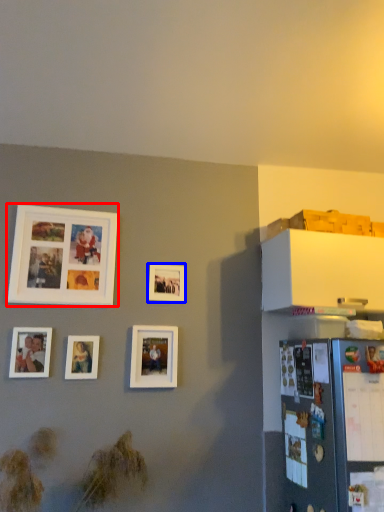
Question: Which of the following is the farthest to the observer, picture frame (highlighted by a red box) or picture frame (highlighted by a blue box)?

Choices:
 (A) picture frame
 (B) picture frame

Answer: (B)